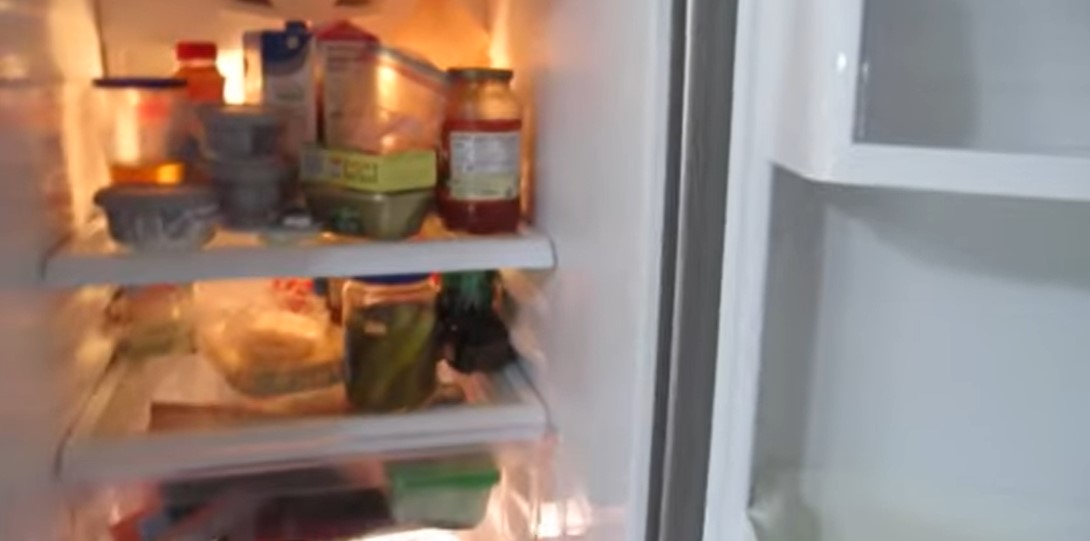
Detect presence of where you would open the fridge drawer in the image and mark them. Your answer should be formatted as a list of tuples, i.e. [(x1, y1), (x2, y2), ...], where each tuple contains the x and y coordinates of a point satisfying the conditions above.

[(331, 480)]